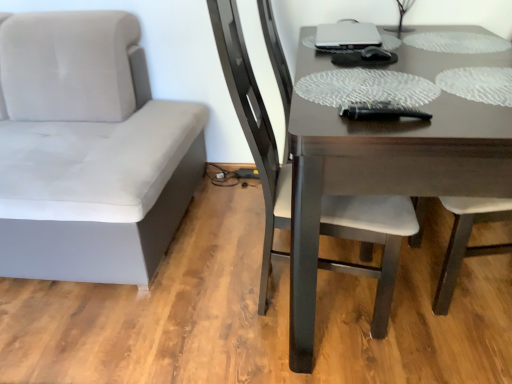
Find the location of a particular element. vacant space that is to the left of dark brown wood chair at center, arranged as the second chair when viewed from the left is located at coordinates (187, 307).